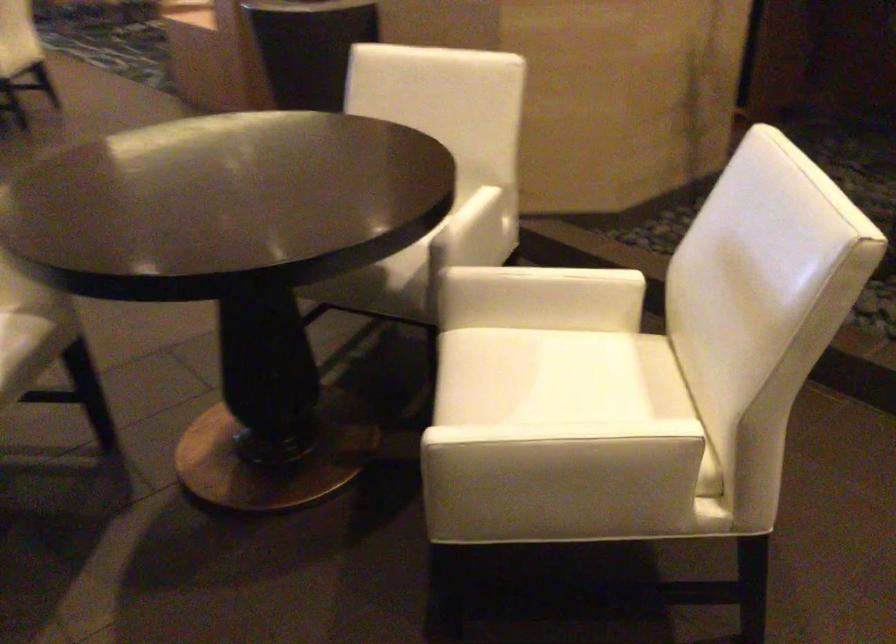
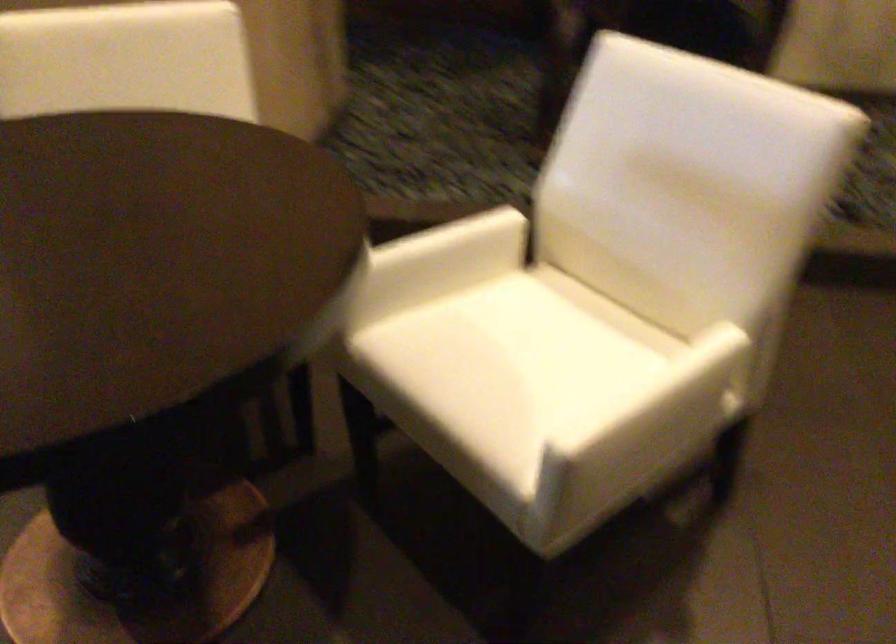
Where in the second image is the point corresponding to (x=572, y=283) from the first image?

(468, 239)